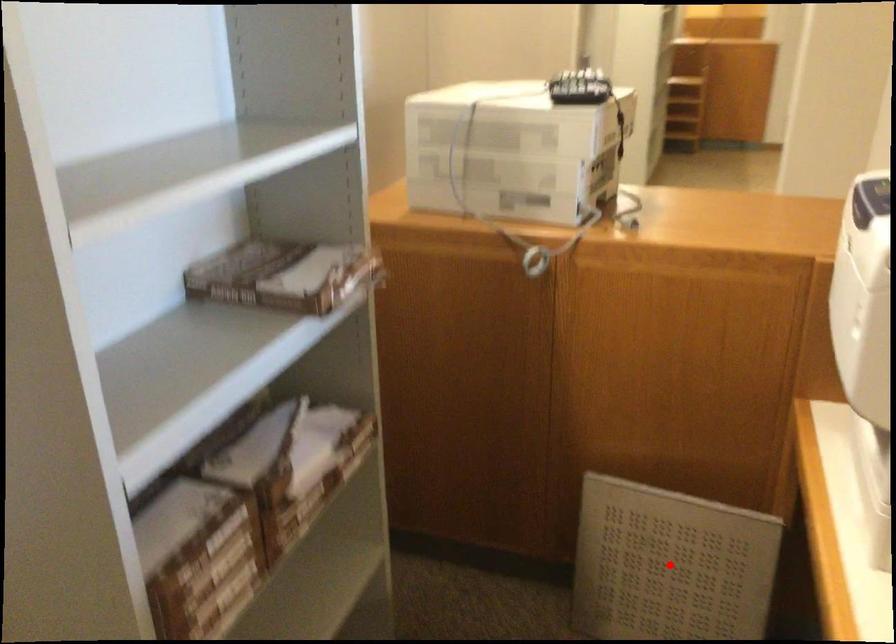
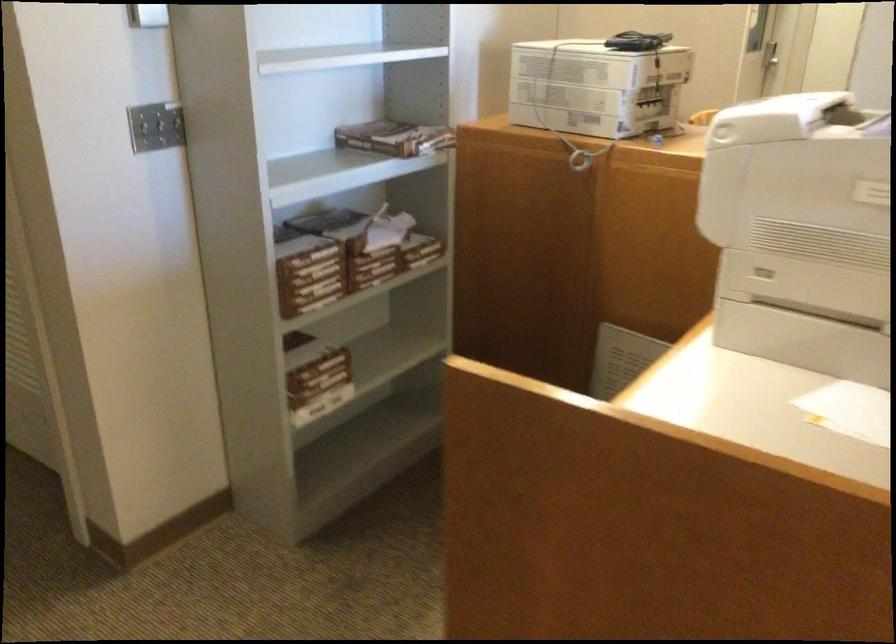
Question: I am providing you with two images of the same scene from different viewpoints. A red point is marked on the first image. Is the red point's position out of view in image 2?

Choices:
 (A) Yes
 (B) No

Answer: (A)